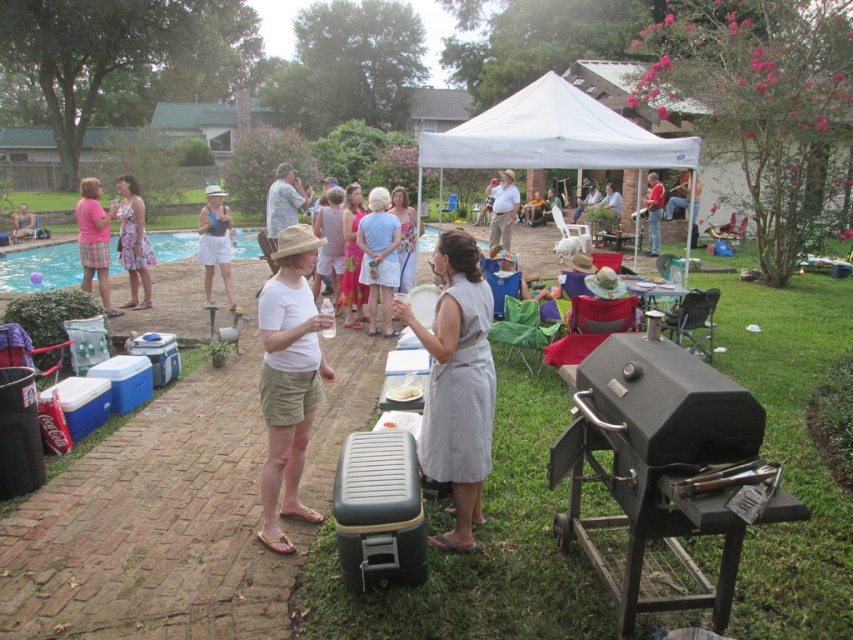
Question: Is hawaiian shirt at center behind light brown fabric shirt at center?

Choices:
 (A) no
 (B) yes

Answer: (B)

Question: Can you confirm if hawaiian shirt at center is positioned below matte black laptop at left?

Choices:
 (A) yes
 (B) no

Answer: (A)

Question: Which point is farther to the camera?

Choices:
 (A) [x=308, y=349]
 (B) [x=553, y=83]

Answer: (B)

Question: Which object is positioned closest to the matte pink shirt at left?

Choices:
 (A) blue glossy pool at left
 (B) gray cotton dress at center
 (C) white fabric tent at upper center

Answer: (B)

Question: Among these objects, which one is nearest to the camera?

Choices:
 (A) red shirt at upper center
 (B) black matte barbecue grill at lower right
 (C) white fabric tent at upper center

Answer: (B)

Question: Does white cotton shirt at center appear under blue glossy pool at left?

Choices:
 (A) no
 (B) yes

Answer: (B)